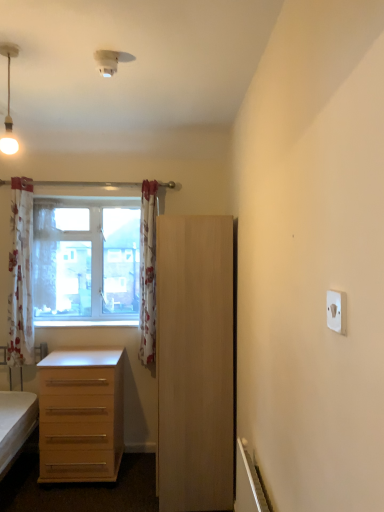
Question: Is white floral curtain at window, the second curtain when ordered from right to left, in front of or behind matte white pendant light at upper left in the image?

Choices:
 (A) behind
 (B) front

Answer: (A)

Question: From the image's perspective, is white floral curtain at window, the second curtain when ordered from right to left, above or below matte white pendant light at upper left?

Choices:
 (A) below
 (B) above

Answer: (A)

Question: Based on their relative distances, which object is farther from the white floral fabric curtain at left, which appears as the third curtain when viewed from the right?

Choices:
 (A) light wood cabinet at center
 (B) clear glass window at upper left
 (C) white glossy window sill at lower center
 (D) light wood drawer at lower left
 (E) floral fabric curtain at center, which appears as the first curtain when viewed from the right

Answer: (A)

Question: Estimate the real-world distances between objects in this image. Which object is farther from the floral fabric curtain at center, which appears as the first curtain when viewed from the right?

Choices:
 (A) white plastic electric outlet at upper right
 (B) clear glass window at upper left
 (C) matte white pendant light at upper left
 (D) white floral curtain at window, the second curtain when ordered from right to left
 (E) white floral fabric curtain at left, which appears as the third curtain when viewed from the right

Answer: (A)